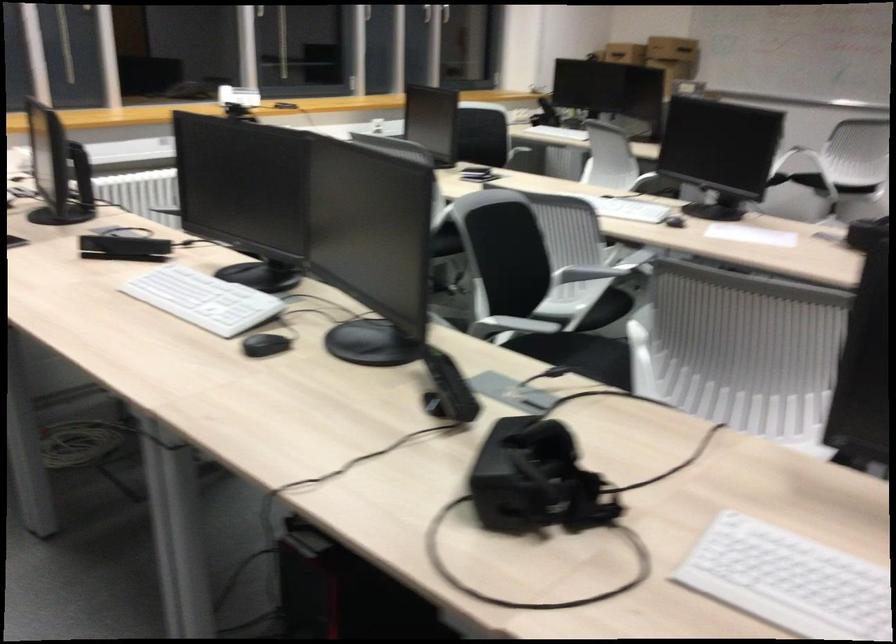
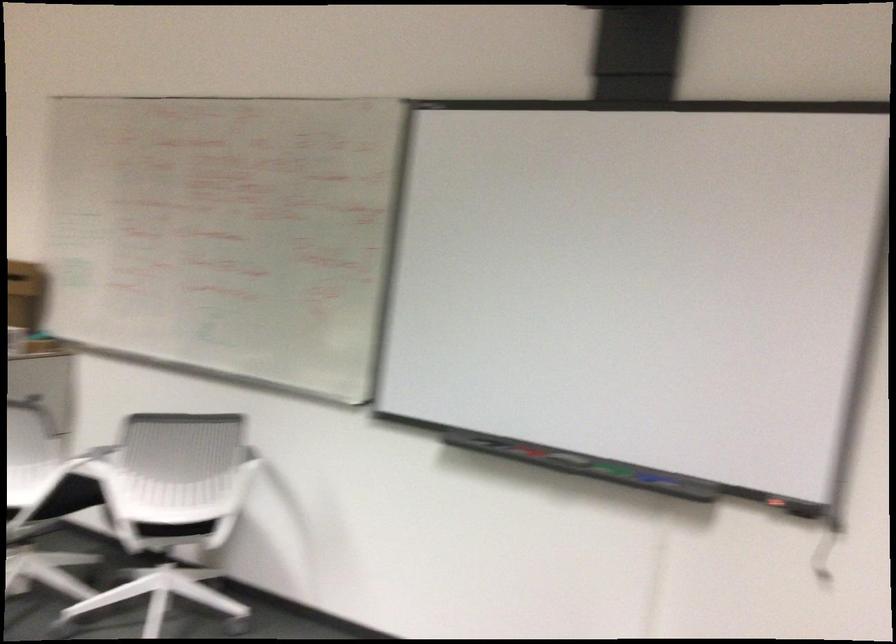
Which direction would the cameraman need to move to produce the second image?

The movement direction of the cameraman is right, forward.